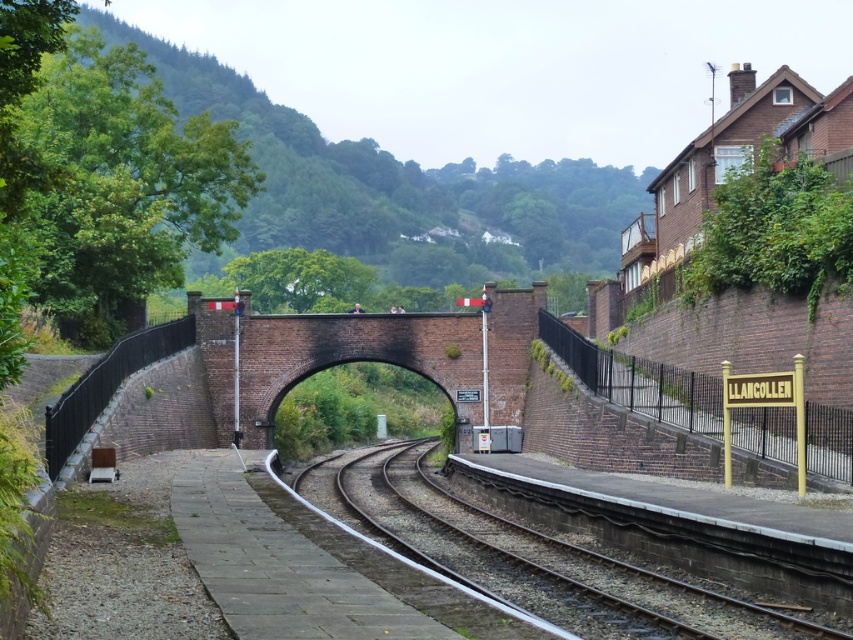
Question: Does brick archway at center appear under smooth metal tracks at center?

Choices:
 (A) yes
 (B) no

Answer: (B)

Question: Considering the real-world distances, which object is farthest from the gold metallic sign at right?

Choices:
 (A) smooth metal tracks at center
 (B) brick archway at center

Answer: (A)

Question: Estimate the real-world distances between objects in this image. Which object is closer to the gold metallic sign at right?

Choices:
 (A) smooth metal tracks at center
 (B) brick archway at center

Answer: (B)

Question: Can you confirm if brick archway at center is thinner than gold metallic sign at right?

Choices:
 (A) yes
 (B) no

Answer: (B)

Question: Can you confirm if brick archway at center is positioned to the right of smooth metal tracks at center?

Choices:
 (A) yes
 (B) no

Answer: (A)

Question: Which point is farther from the camera taking this photo?

Choices:
 (A) (410, 509)
 (B) (848, 448)
 (C) (741, 461)

Answer: (A)